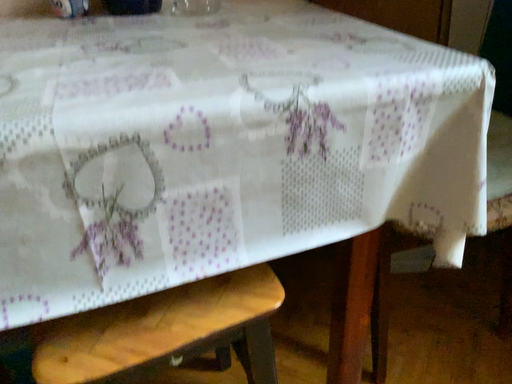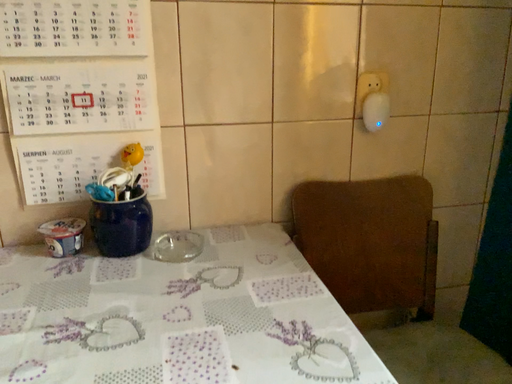
Question: Which way did the camera rotate in the video?

Choices:
 (A) rotated upward
 (B) rotated downward

Answer: (A)